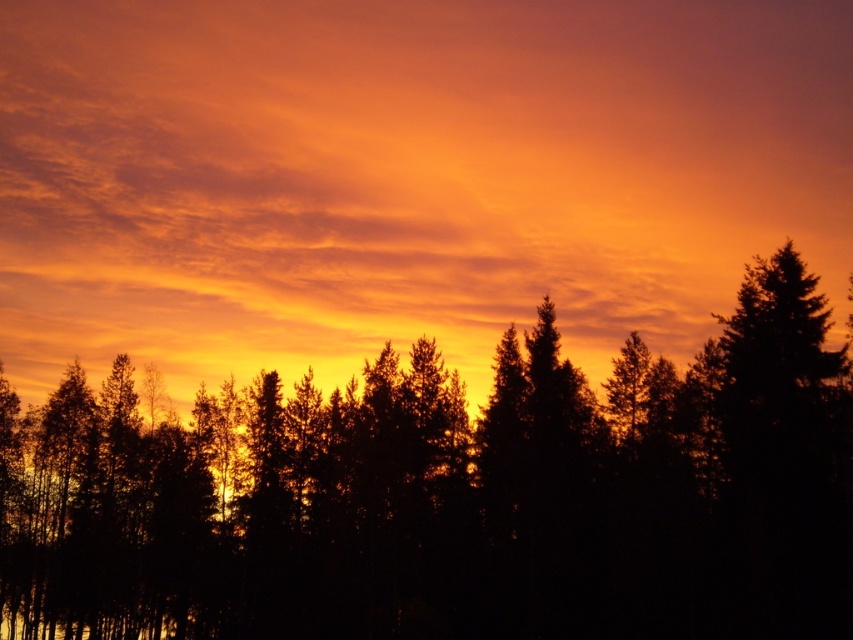
Question: Is orange matte cloud at upper center smaller than black silhouetted trees at center?

Choices:
 (A) no
 (B) yes

Answer: (A)

Question: Is orange matte cloud at upper center below black silhouetted trees at center?

Choices:
 (A) yes
 (B) no

Answer: (B)

Question: Which object is farther from the camera taking this photo?

Choices:
 (A) orange matte cloud at upper center
 (B) black silhouetted trees at center

Answer: (A)

Question: Can you confirm if orange matte cloud at upper center is thinner than black silhouetted trees at center?

Choices:
 (A) yes
 (B) no

Answer: (B)